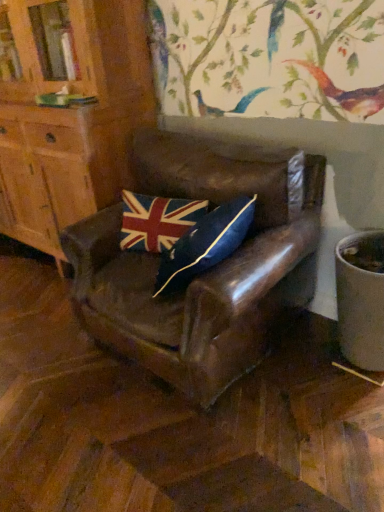
The image size is (384, 512). What do you see at coordinates (157, 221) in the screenshot?
I see `union jack fabric pillow at center` at bounding box center [157, 221].

Locate an element on the screen. union jack fabric pillow at center is located at coordinates (157, 221).

Can you confirm if leather chair at center is taller than matte wood cabinet at left?

In fact, leather chair at center may be shorter than matte wood cabinet at left.

Could you tell me if leather chair at center is facing matte wood cabinet at left?

No.

Which object is positioned more to the left, leather chair at center or matte wood cabinet at left?

Positioned to the left is matte wood cabinet at left.

From a real-world perspective, is leather chair at center positioned above or below matte wood cabinet at left?

In terms of real-world spatial position, leather chair at center is below matte wood cabinet at left.

What's the angular difference between matte wood cabinet at left and union jack fabric pillow at center's facing directions?

12.6 degrees separate the facing orientations of matte wood cabinet at left and union jack fabric pillow at center.

Would you consider matte wood cabinet at left to be distant from union jack fabric pillow at center?

matte wood cabinet at left is actually quite close to union jack fabric pillow at center.

Is union jack fabric pillow at center inside matte wood cabinet at left?

Definitely not — union jack fabric pillow at center is not inside matte wood cabinet at left.

In order to click on flag behind the matte wood cabinet at left in this screenshot , I will do `click(157, 221)`.

Consider the image. From the image's perspective, which is above, union jack fabric pillow at center or leather chair at center?

union jack fabric pillow at center.

From a real-world perspective, does union jack fabric pillow at center stand above leather chair at center?

Yes.

Is union jack fabric pillow at center aimed at leather chair at center?

Yes.

Considering the positions of objects union jack fabric pillow at center and matte wood cabinet at left in the image provided, who is more to the left, union jack fabric pillow at center or matte wood cabinet at left?

From the viewer's perspective, matte wood cabinet at left appears more on the left side.

From a real-world perspective, between union jack fabric pillow at center and matte wood cabinet at left, who is vertically higher?

From a 3D spatial view, matte wood cabinet at left is above.

Considering the points (166, 213) and (9, 0), which point is behind, point (166, 213) or point (9, 0)?

Positioned behind is point (9, 0).

Considering the sizes of union jack fabric pillow at center and matte wood cabinet at left in the image, is union jack fabric pillow at center bigger or smaller than matte wood cabinet at left?

union jack fabric pillow at center is smaller than matte wood cabinet at left.

Identify the location of cabinetry on the left of the leather chair at center. (68, 111).

Does point (83, 46) lie in front of point (211, 185)?

No, it is behind (211, 185).

Which is more to the right, matte wood cabinet at left or leather chair at center?

Positioned to the right is leather chair at center.

From the image's perspective, is leather chair at center above union jack fabric pillow at center?

Incorrect, from the image's perspective, leather chair at center is lower than union jack fabric pillow at center.

Considering the relative sizes of leather chair at center and union jack fabric pillow at center in the image provided, is leather chair at center taller than union jack fabric pillow at center?

Correct, leather chair at center is much taller as union jack fabric pillow at center.

Between leather chair at center and union jack fabric pillow at center, which one is positioned behind?

union jack fabric pillow at center is behind.

Consider the image. Is leather chair at center next to union jack fabric pillow at center?

No, leather chair at center is not in contact with union jack fabric pillow at center.

Where is `cabinetry on the left of leather chair at center`? cabinetry on the left of leather chair at center is located at coordinates pyautogui.click(x=68, y=111).

Where is `flag lying behind the matte wood cabinet at left`? The width and height of the screenshot is (384, 512). flag lying behind the matte wood cabinet at left is located at coordinates (157, 221).

Estimate the real-world distances between objects in this image. Which object is further from matte wood cabinet at left, leather chair at center or union jack fabric pillow at center?

leather chair at center lies further to matte wood cabinet at left than the other object.

Based on their spatial positions, is union jack fabric pillow at center or leather chair at center further from matte wood cabinet at left?

The object further to matte wood cabinet at left is leather chair at center.

Considering their positions, is matte wood cabinet at left positioned closer to union jack fabric pillow at center than leather chair at center?

The object closer to union jack fabric pillow at center is leather chair at center.

Looking at the image, which one is located further to union jack fabric pillow at center, leather chair at center or matte wood cabinet at left?

The object further to union jack fabric pillow at center is matte wood cabinet at left.

Looking at the image, which one is located closer to leather chair at center, matte wood cabinet at left or union jack fabric pillow at center?

The object closer to leather chair at center is union jack fabric pillow at center.

Consider the image. Estimate the real-world distances between objects in this image. Which object is closer to leather chair at center, union jack fabric pillow at center or matte wood cabinet at left?

union jack fabric pillow at center is positioned closer to the anchor leather chair at center.

Find the location of a particular element. flag located between matte wood cabinet at left and leather chair at center in the left-right direction is located at coordinates (157, 221).